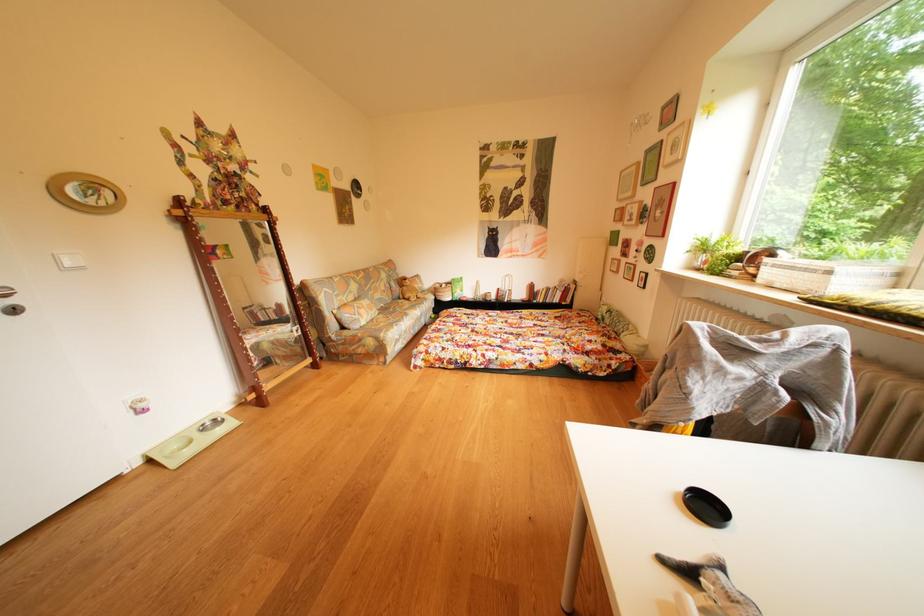
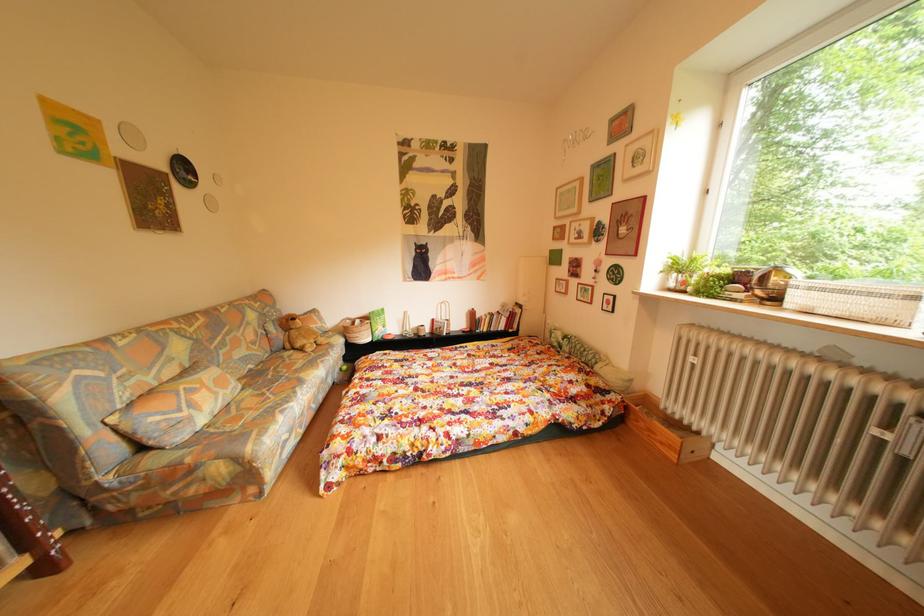
Question: Based on the continuous images, in which direction is the camera rotating? Reply with the corresponding letter.

Choices:
 (A) Left
 (B) Right
 (C) Up
 (D) Down

Answer: (B)